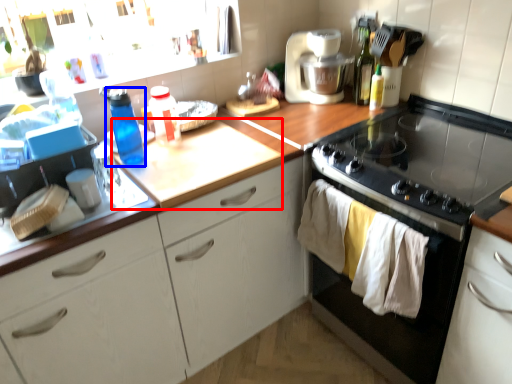
Question: Which object appears closest to the camera in this image, counter top (highlighted by a red box) or bottle (highlighted by a blue box)?

Choices:
 (A) counter top
 (B) bottle

Answer: (A)